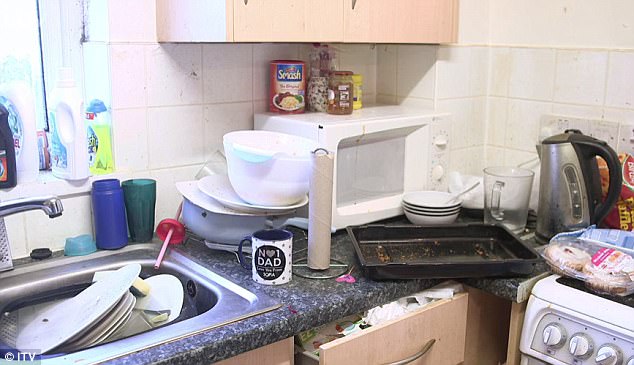
Find the location of a particular element. The height and width of the screenshot is (365, 634). bowl is located at coordinates (257, 170), (210, 224).